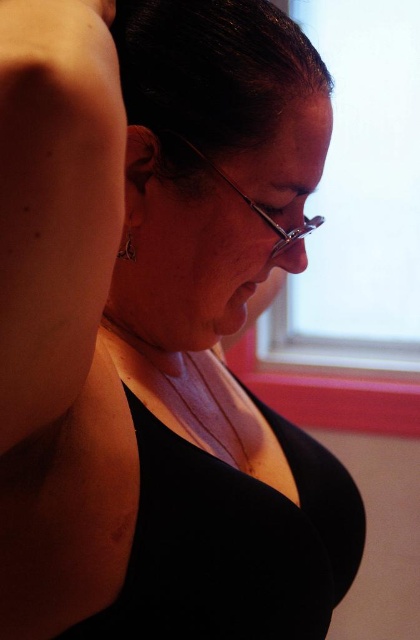
You are designing a catalog layout and need to place the black matte dress at center and the silver metallic earring at upper left next to each other. Based on their sizes, which object should be placed on the left side to ensure proper alignment?

The black matte dress at center should be placed on the left side because its width surpasses the silver metallic earring at upper left, so positioning the wider item first will maintain alignment.

You are a photographer setting up for a photoshoot. You have a camera with a focal length of 50mm. The subject is wearing a black matte dress at center and has a silver metallic earring at upper left. To ensure both objects are in focus, what is the minimum distance you should set your camera lens to?

The minimum distance should be set to 12.79 inches to ensure both the black matte dress at center and the silver metallic earring at upper left are in focus, as they are separated by that distance.